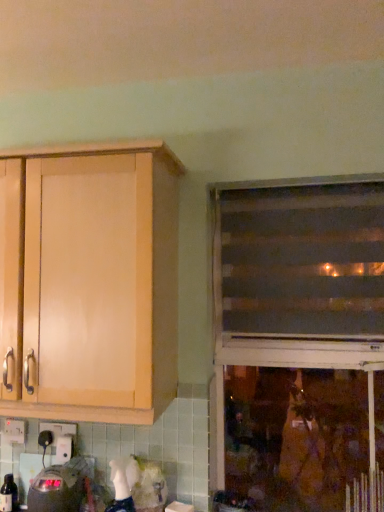
This screenshot has height=512, width=384. What do you see at coordinates (61, 487) in the screenshot?
I see `matte black digital clock at lower left` at bounding box center [61, 487].

Where is `translucent glass bottle at lower left`? Image resolution: width=384 pixels, height=512 pixels. translucent glass bottle at lower left is located at coordinates (9, 495).

At what (x,y) coordinates should I click in order to perform the action: click on matte wooden window at right, marked as the second window in a top-to-bottom arrangement. Please return your answer as a coordinate pair (x, y). Looking at the image, I should click on pos(297,341).

This screenshot has height=512, width=384. What do you see at coordinates (366, 492) in the screenshot?
I see `metallic silver radiator at lower right` at bounding box center [366, 492].

Where is `metallic silver radiator at lower right`? metallic silver radiator at lower right is located at coordinates click(x=366, y=492).

How much space does black plastic electric outlet at lower left, which ranks as the second electric outlet in left-to-right order, occupy vertically?

black plastic electric outlet at lower left, which ranks as the second electric outlet in left-to-right order, is 4.00 inches tall.

Where is `white plastic electric outlet at lower left, the first electric outlet from the left`? white plastic electric outlet at lower left, the first electric outlet from the left is located at coordinates (14, 431).

The height and width of the screenshot is (512, 384). Find the location of `cabinetry lying in front of the translucent glass bottle at lower left`. cabinetry lying in front of the translucent glass bottle at lower left is located at coordinates (100, 282).

From the image's perspective, which one is positioned higher, light wood cabinet at upper left or translucent glass bottle at lower left?

light wood cabinet at upper left is shown above in the image.

Is light wood cabinet at upper left taller than translucent glass bottle at lower left?

Correct, light wood cabinet at upper left is much taller as translucent glass bottle at lower left.

Which object is further away from the camera taking this photo, light wood cabinet at upper left or translucent glass bottle at lower left?

translucent glass bottle at lower left is behind.

Which is correct: white plastic electric outlet at lower left, the first electric outlet from the left, is inside light wood cabinet at upper left, or outside of it?

white plastic electric outlet at lower left, the first electric outlet from the left, exists outside the volume of light wood cabinet at upper left.

Which object is more forward, white plastic electric outlet at lower left, the first electric outlet from the left, or light wood cabinet at upper left?

light wood cabinet at upper left is more forward.

From a real-world perspective, which is physically below, white plastic electric outlet at lower left, the first electric outlet from the left, or light wood cabinet at upper left?

From a 3D spatial view, white plastic electric outlet at lower left, the first electric outlet from the left, is below.

Is white plastic electric outlet at lower left, which appears as the 2th electric outlet when viewed from the right, facing away from brown striped blinds at right, which is the second window from bottom to top?

No, brown striped blinds at right, which is the second window from bottom to top, is not at the back of white plastic electric outlet at lower left, which appears as the 2th electric outlet when viewed from the right.

Can you confirm if white plastic electric outlet at lower left, the first electric outlet from the left, is positioned to the right of brown striped blinds at right, which is the second window from bottom to top?

In fact, white plastic electric outlet at lower left, the first electric outlet from the left, is to the left of brown striped blinds at right, which is the second window from bottom to top.

Is point (16, 430) less distant than point (254, 265)?

Yes, it is.

Is there a large distance between white plastic electric outlet at lower left, the first electric outlet from the left, and brown striped blinds at right, positioned as the first window in top-to-bottom order?

That's right, there is a large distance between white plastic electric outlet at lower left, the first electric outlet from the left, and brown striped blinds at right, positioned as the first window in top-to-bottom order.

In the image, is metallic silver radiator at lower right positioned in front of or behind matte black digital clock at lower left?

metallic silver radiator at lower right is in front of matte black digital clock at lower left.

Is point (371, 505) less distant than point (47, 492)?

No, it is behind (47, 492).

Considering the sizes of metallic silver radiator at lower right and matte black digital clock at lower left in the image, is metallic silver radiator at lower right wider or thinner than matte black digital clock at lower left?

Clearly, metallic silver radiator at lower right has more width compared to matte black digital clock at lower left.

In the scene shown: Is metallic silver radiator at lower right inside the boundaries of matte black digital clock at lower left, or outside?

metallic silver radiator at lower right is located beyond the bounds of matte black digital clock at lower left.

From the image's perspective, is black plastic electric outlet at lower left, which ranks as the second electric outlet in left-to-right order, located above or below light wood cabinet at upper left?

Clearly, from the image's perspective, black plastic electric outlet at lower left, which ranks as the second electric outlet in left-to-right order, is below light wood cabinet at upper left.

Is black plastic electric outlet at lower left, the 1th electric outlet when ordered from right to left, behind light wood cabinet at upper left?

Yes, black plastic electric outlet at lower left, the 1th electric outlet when ordered from right to left, is behind light wood cabinet at upper left.

Is black plastic electric outlet at lower left, the 1th electric outlet when ordered from right to left, wider than light wood cabinet at upper left?

No.

Is black plastic electric outlet at lower left, which ranks as the second electric outlet in left-to-right order, smaller than light wood cabinet at upper left?

Correct, black plastic electric outlet at lower left, which ranks as the second electric outlet in left-to-right order, occupies less space than light wood cabinet at upper left.

Is matte wooden window at right, placed as the first window when sorted from bottom to top, surrounding metallic silver radiator at lower right?

Absolutely, metallic silver radiator at lower right is inside matte wooden window at right, placed as the first window when sorted from bottom to top.

Consider the image. From a real-world perspective, does matte wooden window at right, marked as the second window in a top-to-bottom arrangement, sit lower than metallic silver radiator at lower right?

No, from a real-world perspective, matte wooden window at right, marked as the second window in a top-to-bottom arrangement, is not under metallic silver radiator at lower right.

Consider the image. Is matte wooden window at right, placed as the first window when sorted from bottom to top, next to metallic silver radiator at lower right and touching it?

No.

Which object is wider, matte wooden window at right, placed as the first window when sorted from bottom to top, or metallic silver radiator at lower right?

metallic silver radiator at lower right.

Looking at this image, are matte wooden window at right, placed as the first window when sorted from bottom to top, and white plastic electric outlet at lower left, which appears as the 2th electric outlet when viewed from the right, far apart?

matte wooden window at right, placed as the first window when sorted from bottom to top, is positioned a significant distance from white plastic electric outlet at lower left, which appears as the 2th electric outlet when viewed from the right.

Is point (250, 433) closer or farther from the camera than point (4, 431)?

Point (250, 433) is positioned farther from the camera compared to point (4, 431).

Is matte wooden window at right, marked as the second window in a top-to-bottom arrangement, spatially inside white plastic electric outlet at lower left, the first electric outlet from the left, or outside of it?

matte wooden window at right, marked as the second window in a top-to-bottom arrangement, is spatially situated outside white plastic electric outlet at lower left, the first electric outlet from the left.

In the image, is matte wooden window at right, placed as the first window when sorted from bottom to top, positioned in front of or behind white plastic electric outlet at lower left, the first electric outlet from the left?

Visually, matte wooden window at right, placed as the first window when sorted from bottom to top, is located in front of white plastic electric outlet at lower left, the first electric outlet from the left.

Where is `bottle beneath the light wood cabinet at upper left (from a real-world perspective)`? bottle beneath the light wood cabinet at upper left (from a real-world perspective) is located at coordinates (9, 495).

You are a GUI agent. You are given a task and a screenshot of the screen. Output one action in this format:
    pyautogui.click(x=<x>, y=<y>)
    Task: Click on the electric outlet that is the 2nd one when counting leftward from the light wood cabinet at upper left
    This screenshot has height=512, width=384.
    Given the screenshot: What is the action you would take?
    pyautogui.click(x=14, y=431)

Considering their positions, is metallic silver radiator at lower right positioned further to matte wooden window at right, marked as the second window in a top-to-bottom arrangement, than brown striped blinds at right, positioned as the first window in top-to-bottom order?

Answer: metallic silver radiator at lower right.

Estimate the real-world distances between objects in this image. Which object is further from black plastic electric outlet at lower left, the 1th electric outlet when ordered from right to left, translucent glass bottle at lower left or brown striped blinds at right, positioned as the first window in top-to-bottom order?

brown striped blinds at right, positioned as the first window in top-to-bottom order, is further to black plastic electric outlet at lower left, the 1th electric outlet when ordered from right to left.

When comparing their distances from light wood cabinet at upper left, does matte black digital clock at lower left or white plastic electric outlet at lower left, the first electric outlet from the left, seem further?

white plastic electric outlet at lower left, the first electric outlet from the left, is further to light wood cabinet at upper left.

When comparing their distances from metallic silver radiator at lower right, does translucent glass bottle at lower left or black plastic electric outlet at lower left, which ranks as the second electric outlet in left-to-right order, seem closer?

The object closer to metallic silver radiator at lower right is black plastic electric outlet at lower left, which ranks as the second electric outlet in left-to-right order.

From the image, which object appears to be farther from metallic silver radiator at lower right, translucent glass bottle at lower left or white plastic electric outlet at lower left, which appears as the 2th electric outlet when viewed from the right?

white plastic electric outlet at lower left, which appears as the 2th electric outlet when viewed from the right, lies further to metallic silver radiator at lower right than the other object.

Looking at the image, which one is located closer to brown striped blinds at right, which is the second window from bottom to top, matte black digital clock at lower left or translucent glass bottle at lower left?

matte black digital clock at lower left is positioned closer to the anchor brown striped blinds at right, which is the second window from bottom to top.

Estimate the real-world distances between objects in this image. Which object is closer to light wood cabinet at upper left, translucent glass bottle at lower left or metallic silver radiator at lower right?

Among the two, translucent glass bottle at lower left is located nearer to light wood cabinet at upper left.

Which object lies further to the anchor point light wood cabinet at upper left, brown striped blinds at right, which is the second window from bottom to top, or metallic silver radiator at lower right?

metallic silver radiator at lower right is positioned further to the anchor light wood cabinet at upper left.

Locate an element on the screen. window located between white plastic electric outlet at lower left, the first electric outlet from the left, and matte wooden window at right, placed as the first window when sorted from bottom to top, in the left-right direction is located at coordinates (300, 260).

The width and height of the screenshot is (384, 512). I want to click on cabinetry located between matte black digital clock at lower left and brown striped blinds at right, which is the second window from bottom to top, in the left-right direction, so click(x=100, y=282).

This screenshot has height=512, width=384. Identify the location of cabinetry located between white plastic electric outlet at lower left, which appears as the 2th electric outlet when viewed from the right, and metallic silver radiator at lower right in the left-right direction. (100, 282).

Locate an element on the screen. window situated between translucent glass bottle at lower left and matte wooden window at right, marked as the second window in a top-to-bottom arrangement, from left to right is located at coordinates (300, 260).